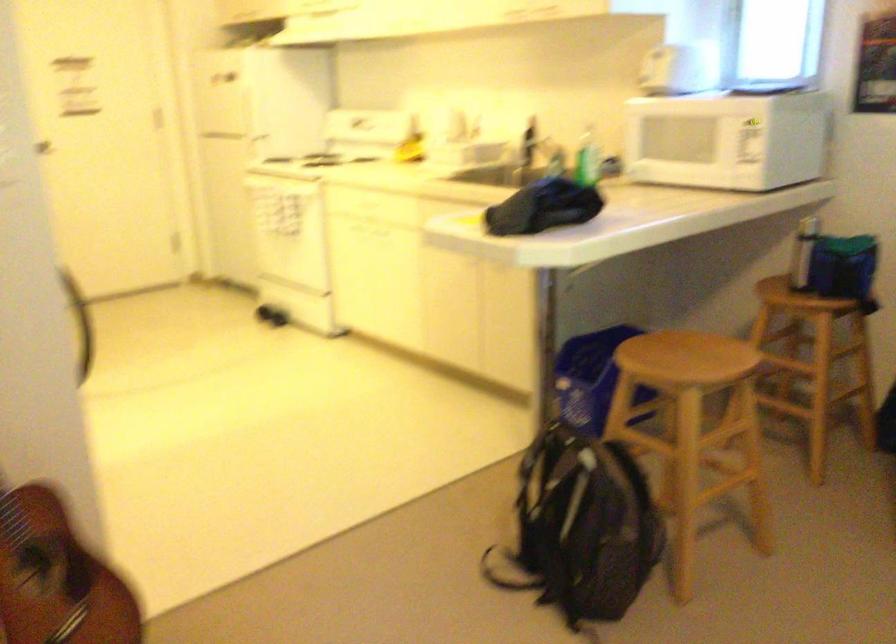
Find where to pull the microwave door handle. Please return your answer as a coordinate pair (x, y).

(748, 158)